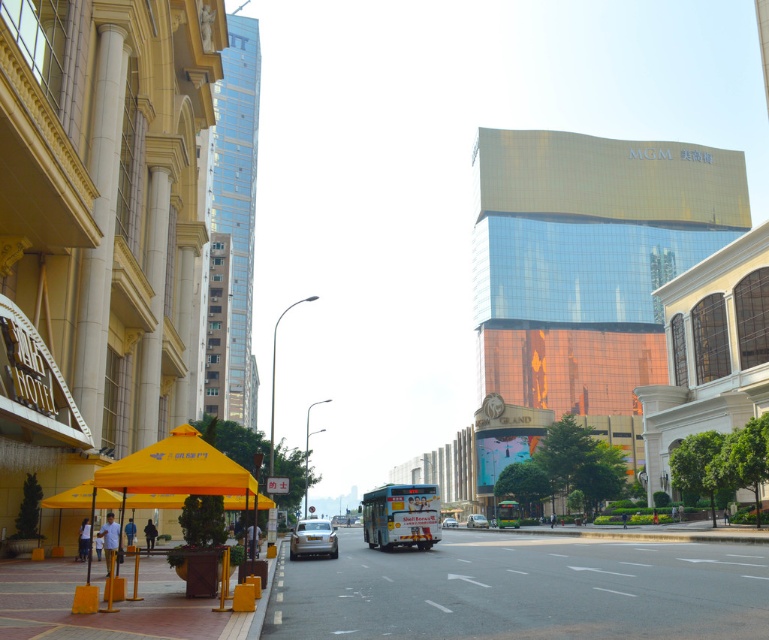
Question: Does yellow fabric canopy at lower left appear over white glossy bus at center?

Choices:
 (A) no
 (B) yes

Answer: (B)

Question: Estimate the real-world distances between objects in this image. Which object is farther from the white glossy bus at center?

Choices:
 (A) silver metallic car at center
 (B) yellow fabric canopy at lower left
 (C) gray asphalt road at center

Answer: (A)

Question: Which object is farther from the camera taking this photo?

Choices:
 (A) white glossy bus at center
 (B) gold metallic car at center

Answer: (A)

Question: Does gray asphalt road at center appear under green metallic bus at center?

Choices:
 (A) no
 (B) yes

Answer: (A)

Question: Among these points, which one is nearest to the camera?

Choices:
 (A) (501, 513)
 (B) (378, 508)

Answer: (B)

Question: Is gray asphalt road at center to the left of green metallic bus at center from the viewer's perspective?

Choices:
 (A) no
 (B) yes

Answer: (B)